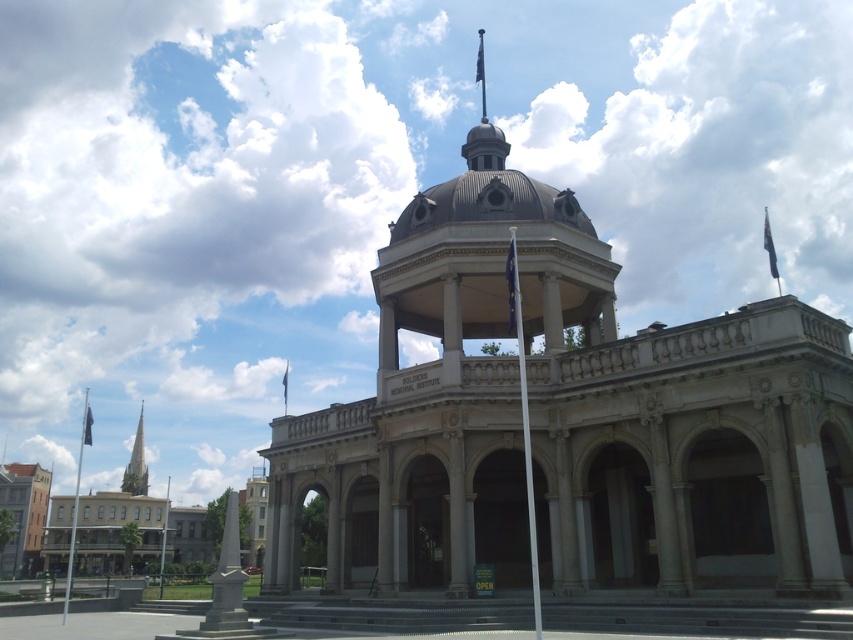
Who is more forward, (137, 426) or (283, 408)?

Point (283, 408) is in front.

Is smooth gray steeple at left bigger than black fabric flag at upper center?

No.

Identify the location of smooth gray steeple at left. (136, 464).

The width and height of the screenshot is (853, 640). What are the coordinates of `smooth gray steeple at left` in the screenshot? It's located at (136, 464).

Between black fabric flag at center and blue fabric flag at top, which one is positioned higher?

blue fabric flag at top is higher up.

Image resolution: width=853 pixels, height=640 pixels. Identify the location of black fabric flag at center. (511, 285).

Image resolution: width=853 pixels, height=640 pixels. In order to click on black fabric flag at center in this screenshot , I will do `click(511, 285)`.

At what (x,y) coordinates should I click in order to perform the action: click on black fabric flag at center. Please return your answer as a coordinate pair (x, y). This screenshot has height=640, width=853. Looking at the image, I should click on (511, 285).

Between point (494, 458) and point (138, 465), which one is positioned behind?

The point (138, 465) is more distant.

Is point (732, 432) in front of point (140, 433)?

Yes.

What do you see at coordinates (567, 422) in the screenshot? I see `gray stone building at center` at bounding box center [567, 422].

What are the coordinates of `gray stone building at center` in the screenshot? It's located at (567, 422).